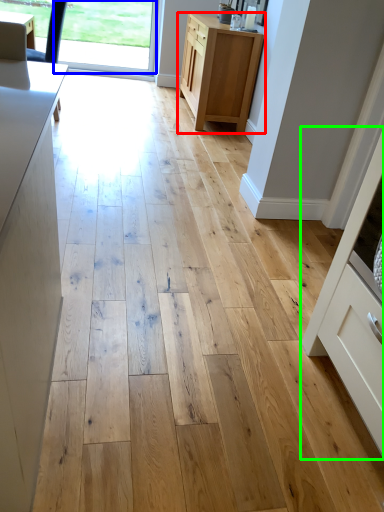
Question: Considering the real-world distances, which object is closest to cabinetry (highlighted by a red box)? window screen (highlighted by a blue box) or cabinetry (highlighted by a green box).

Choices:
 (A) window screen
 (B) cabinetry

Answer: (A)